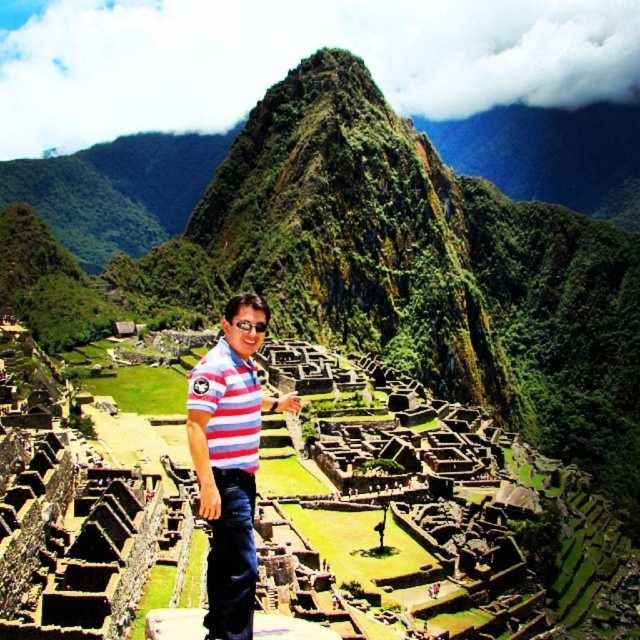
Question: Which point is closer to the camera taking this photo?

Choices:
 (A) (209, 417)
 (B) (221, 465)

Answer: (A)

Question: In this image, where is striped cotton shirt at center located relative to striped cotton polo shirt at center?

Choices:
 (A) below
 (B) above

Answer: (A)

Question: Considering the relative positions of striped cotton shirt at center and striped cotton polo shirt at center in the image provided, where is striped cotton shirt at center located with respect to striped cotton polo shirt at center?

Choices:
 (A) below
 (B) above

Answer: (A)

Question: Which of the following is the closest to the observer?

Choices:
 (A) (243, 394)
 (B) (209, 500)

Answer: (B)

Question: From the image, what is the correct spatial relationship of striped cotton shirt at center in relation to striped cotton polo shirt at center?

Choices:
 (A) below
 (B) above

Answer: (A)